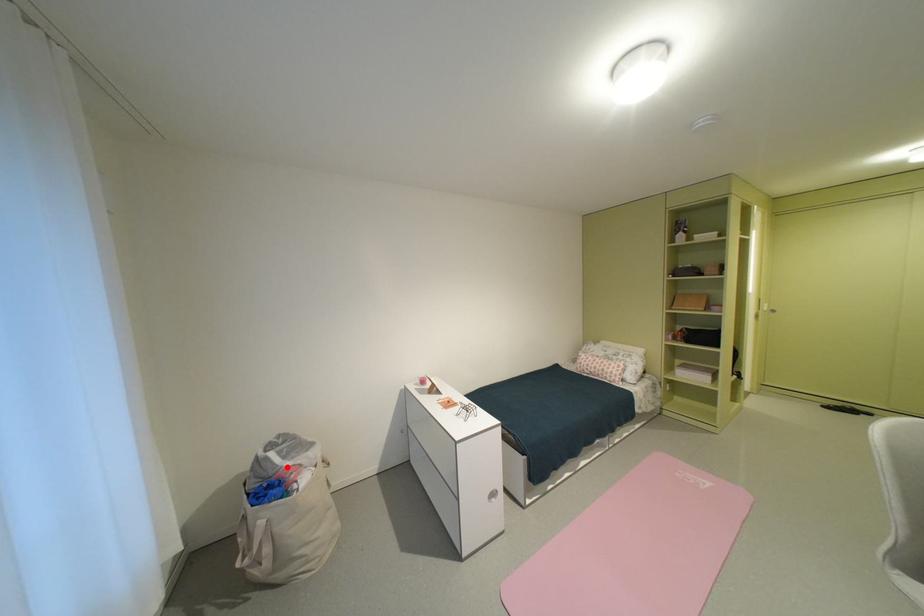
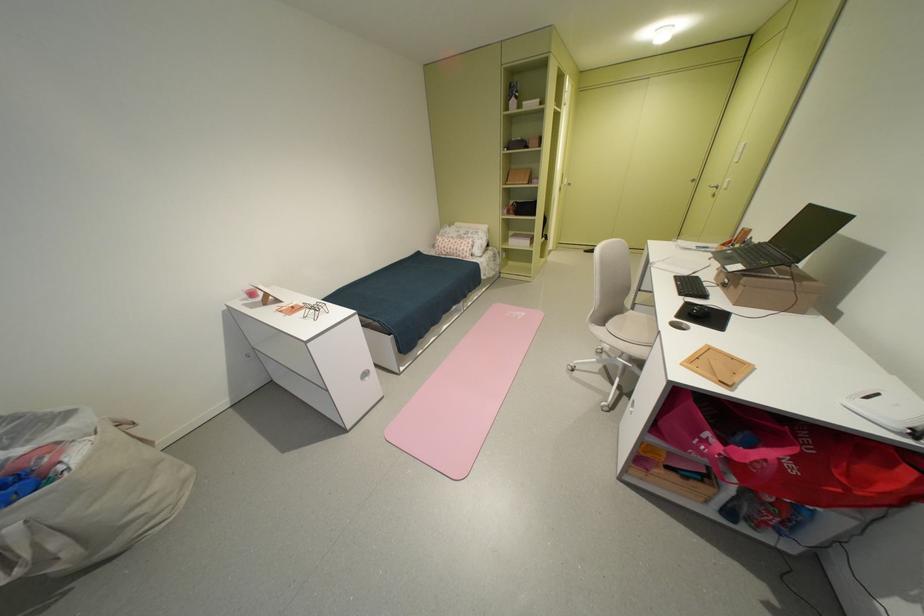
Question: I am providing you with two images of the same scene from different viewpoints. A red point is shown in image1. For the corresponding object point in image2, is it positioned nearer or farther from the camera?

Choices:
 (A) Nearer
 (B) Farther

Answer: (A)